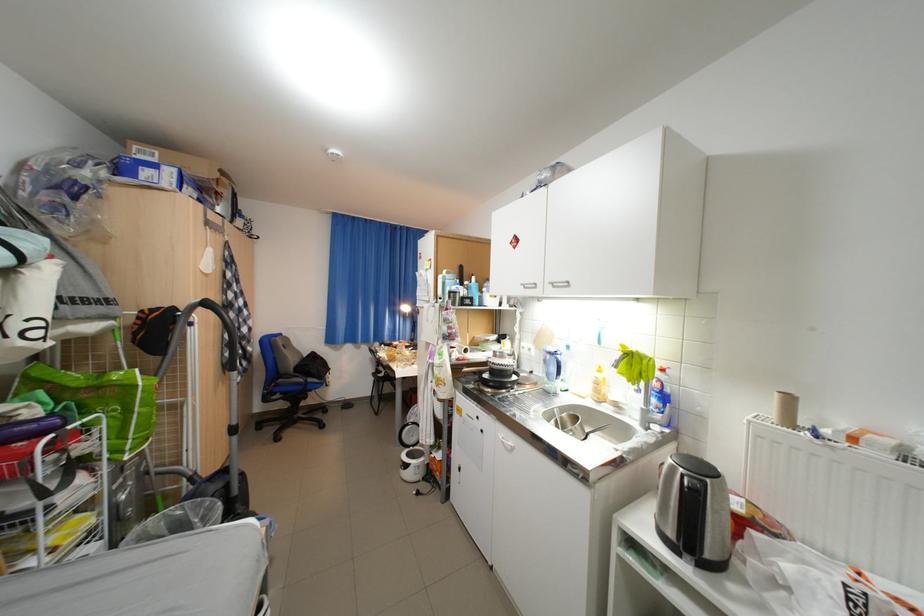
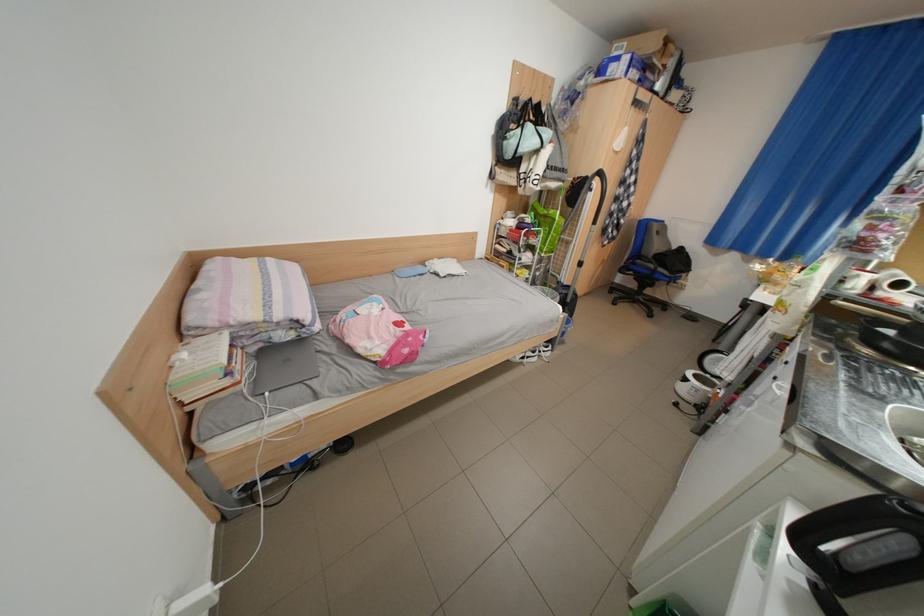
In the second image, find the point that corresponds to point (478, 352) in the first image.

(912, 286)